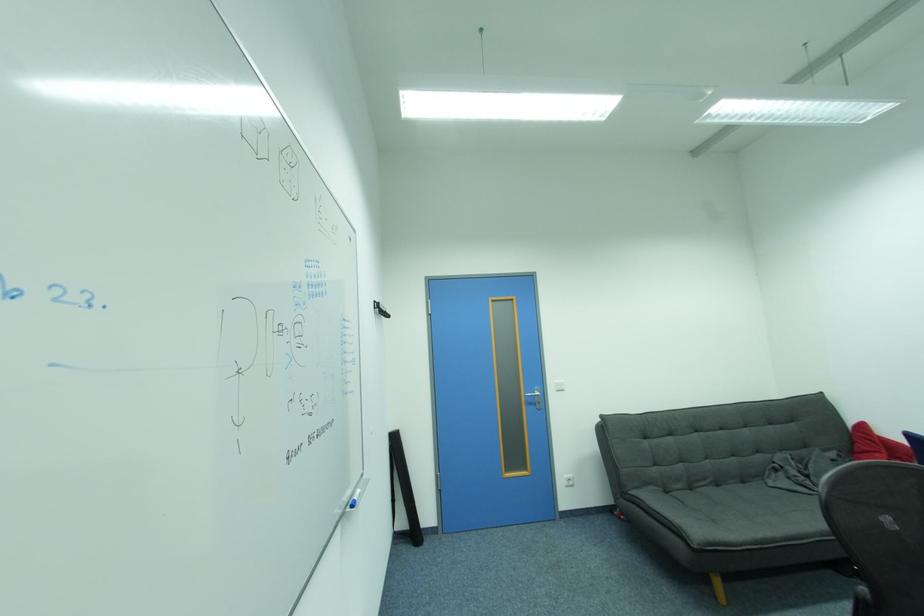
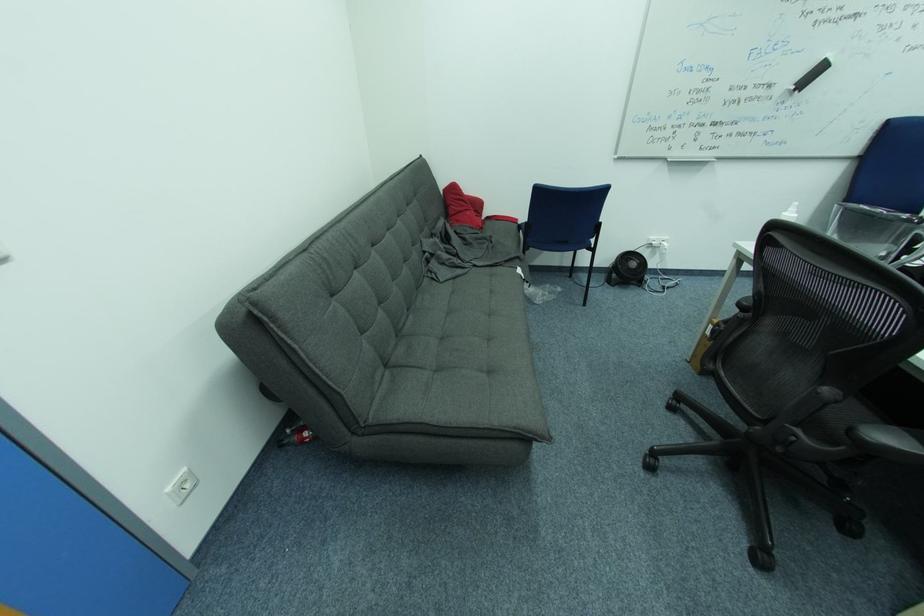
Where in the second image is the point corresponding to point (869, 428) from the first image?

(459, 188)